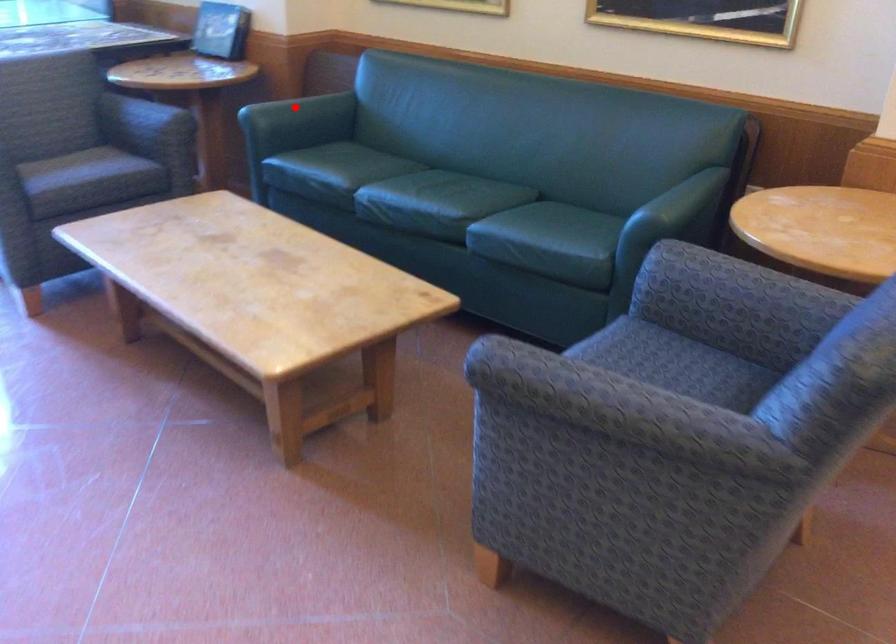
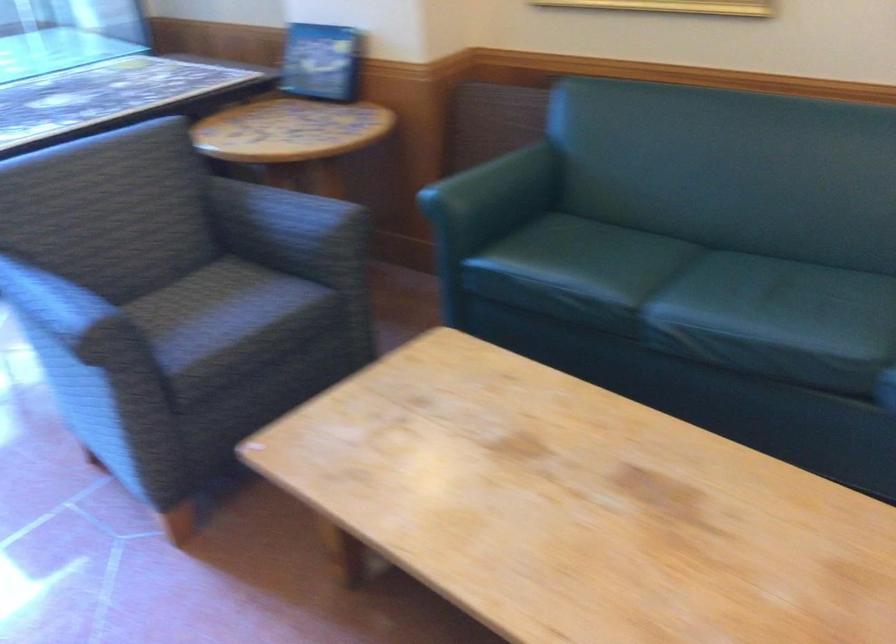
Question: I am providing you with two images of the same scene from different viewpoints. A red point is shown in image1. For the corresponding object point in image2, is it positioned nearer or farther from the camera?

Choices:
 (A) Nearer
 (B) Farther

Answer: (A)